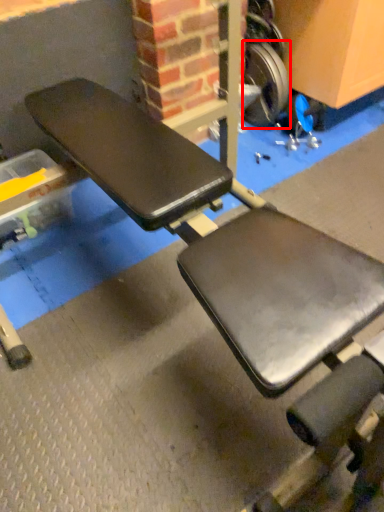
Question: From the image's perspective, what is the correct spatial relationship of wheel (annotated by the red box) in relation to wheel?

Choices:
 (A) below
 (B) above

Answer: (A)